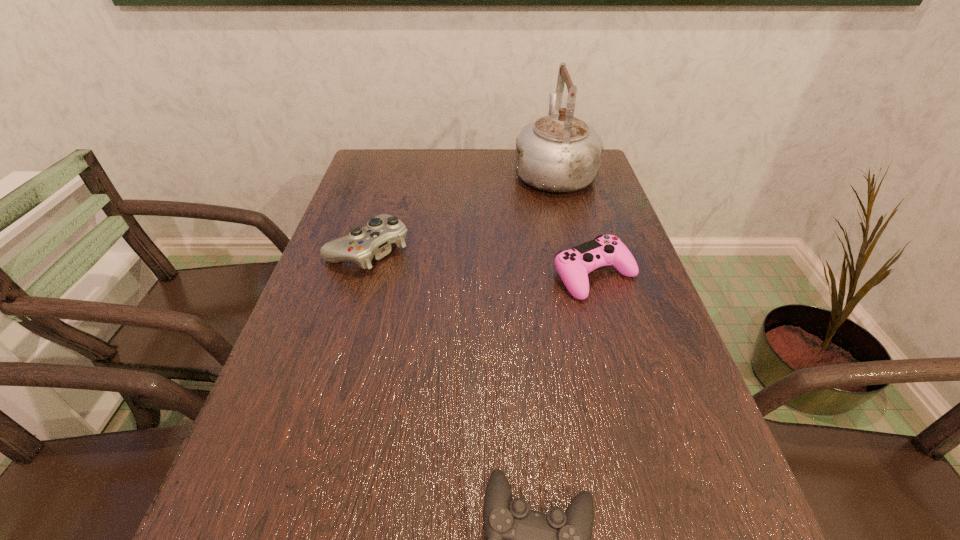
Locate an element on the screen. object that is positioned at the far right corner is located at coordinates pos(556,153).

The image size is (960, 540). In the image, there is a desktop. What are the coordinates of `vacant space at the left edge` in the screenshot? It's located at (227, 518).

This screenshot has height=540, width=960. I want to click on free point between the kettle and the rightmost control, so click(574, 224).

You are a GUI agent. You are given a task and a screenshot of the screen. Output one action in this format:
    pyautogui.click(x=<x>, y=<y>)
    Task: Click on the vacant space that is in between the tallest object and the leftmost object
    
    Given the screenshot: What is the action you would take?
    pyautogui.click(x=461, y=211)

The width and height of the screenshot is (960, 540). I want to click on vacant space in between the leftmost control and the kettle, so click(461, 211).

The image size is (960, 540). What are the coordinates of `free space between the leftmost control and the rightmost control` in the screenshot? It's located at (481, 263).

At what (x,y) coordinates should I click in order to perform the action: click on free space between the leftmost control and the tallest object. Please return your answer as a coordinate pair (x, y). Looking at the image, I should click on (461, 211).

You are a GUI agent. You are given a task and a screenshot of the screen. Output one action in this format:
    pyautogui.click(x=<x>, y=<y>)
    Task: Click on the unoccupied position between the tallest object and the leftmost control
    The image size is (960, 540).
    Given the screenshot: What is the action you would take?
    pyautogui.click(x=461, y=211)

Locate which object is the third closest to the tallest object. Please provide its 2D coordinates. Your answer should be formatted as a tuple, i.e. [(x, y)], where the tuple contains the x and y coordinates of a point satisfying the conditions above.

[(518, 539)]

Point out which object is positioned as the third nearest to the rightmost control. Please provide its 2D coordinates. Your answer should be formatted as a tuple, i.e. [(x, y)], where the tuple contains the x and y coordinates of a point satisfying the conditions above.

[(518, 539)]